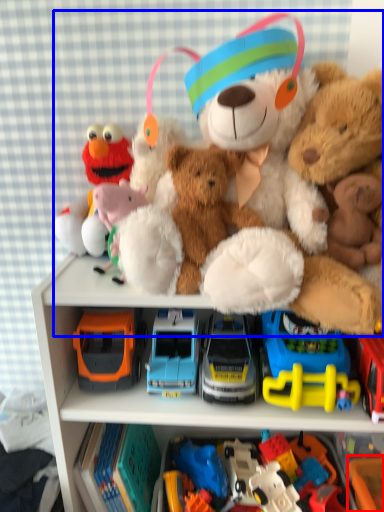
Question: Among these objects, which one is nearest to the camera, toy (highlighted by a red box) or teddy bear (highlighted by a blue box)?

Choices:
 (A) toy
 (B) teddy bear

Answer: (B)